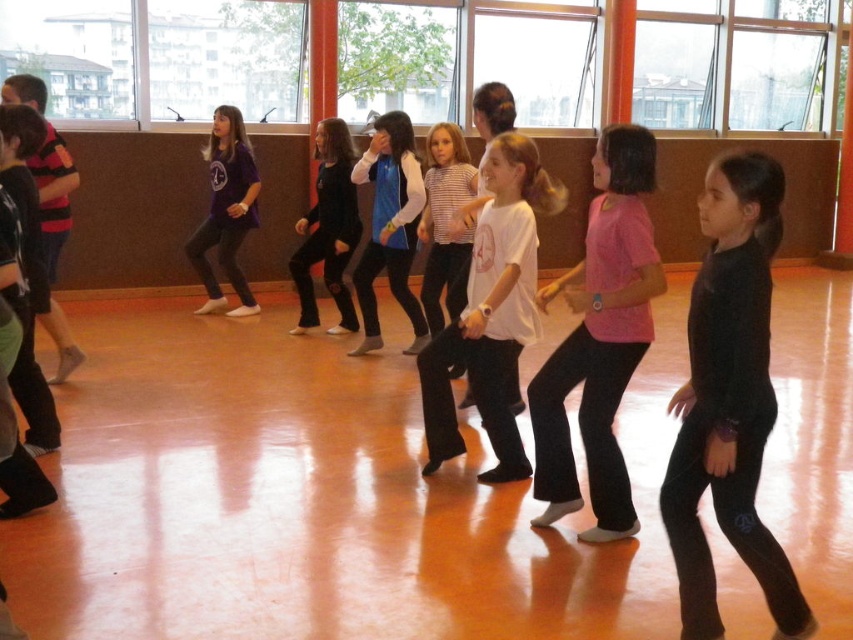
Question: Can you confirm if black matte leggings at right is positioned above matte purple shirt at center?

Choices:
 (A) yes
 (B) no

Answer: (B)

Question: Can you confirm if black matte leggings at right is positioned above matte purple shirt at center?

Choices:
 (A) no
 (B) yes

Answer: (A)

Question: Does black matte leggings at right appear on the left side of pink matte shirt at center?

Choices:
 (A) yes
 (B) no

Answer: (B)

Question: Which point appears farthest from the camera in this image?

Choices:
 (A) (543, 417)
 (B) (355, 243)
 (C) (740, 445)
 (D) (234, 115)

Answer: (D)

Question: Which point is closer to the camera?

Choices:
 (A) (621, 132)
 (B) (758, 177)

Answer: (B)

Question: Which point is farther to the camera?

Choices:
 (A) black matte leggings at right
 (B) pink matte shirt at center
 (C) black matte pants at center

Answer: (C)